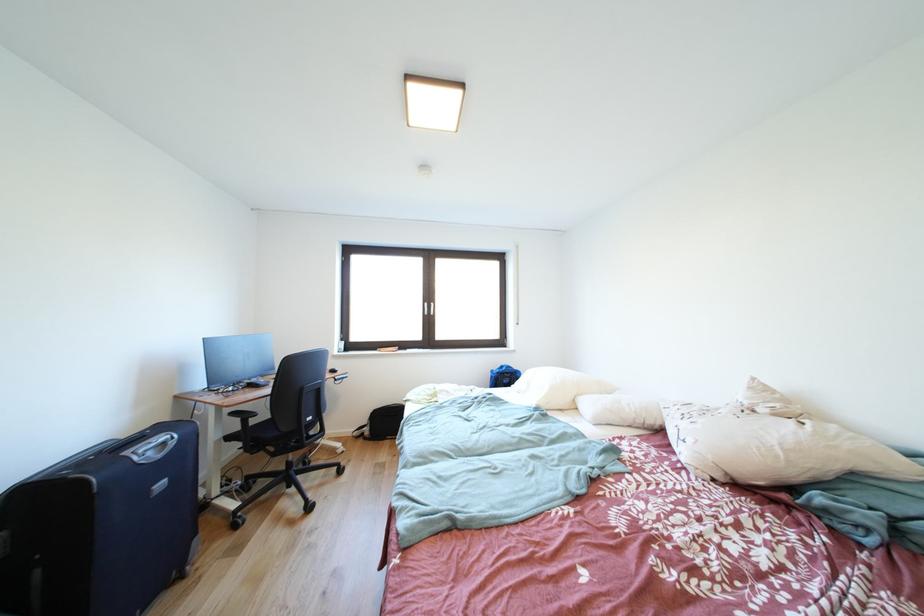
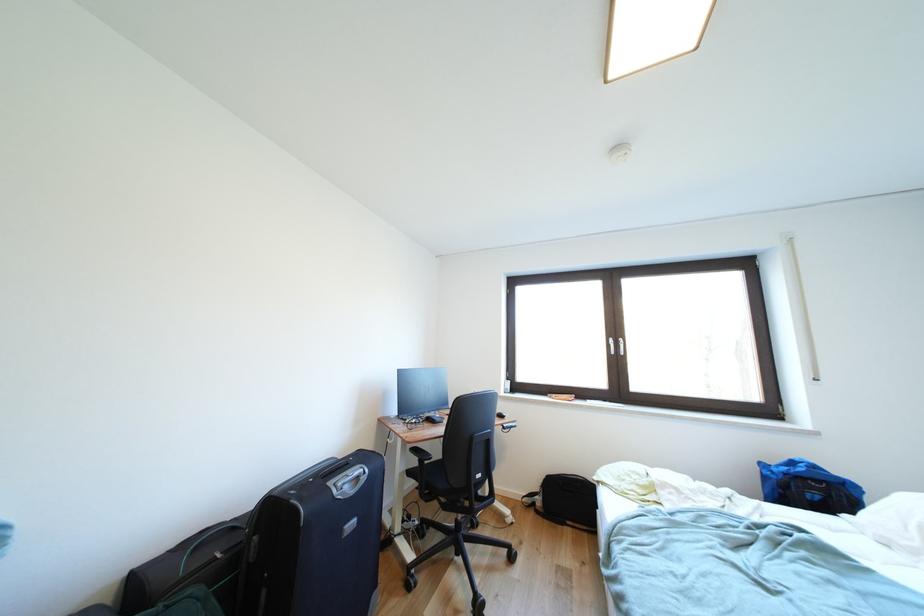
Question: The camera is either moving clockwise (left) or counter-clockwise (right) around the object. The first image is from the beginning of the video and the second image is from the end. Is the camera moving left or right when shooting the video?

Choices:
 (A) Left
 (B) Right

Answer: (B)